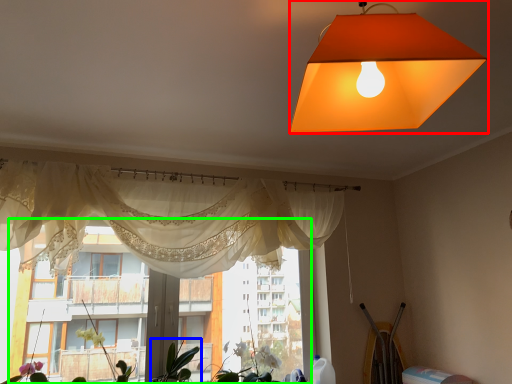
Question: Estimate the real-world distances between objects in this image. Which object is farther from lamp (highlighted by a red box), plant (highlighted by a blue box) or bay window (highlighted by a green box)?

Choices:
 (A) plant
 (B) bay window

Answer: (A)